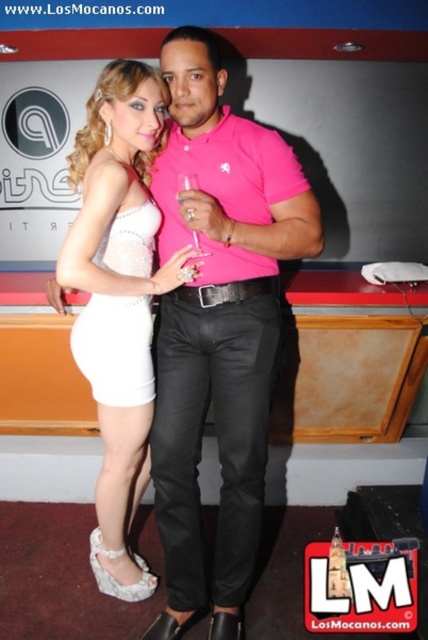
You are a photographer at an event and need to ensure both the matte white dress at center and the white lace dress at left are visible in the photo. Given their height difference, how should you position your camera to capture both effectively?

The matte white dress at center is much taller than the white lace dress at left. To ensure both are visible, position the camera at a lower angle so the taller matte white dress at center doesn not block the shorter white lace dress at left.

You are at a party and want to grab the transparent glass at center without touching the white satin dress at center. Is it possible?

The white satin dress at center is positioned on the left side of transparent glass at center, so there is space between them. Therefore, you can reach the transparent glass at center without touching the white satin dress at center.